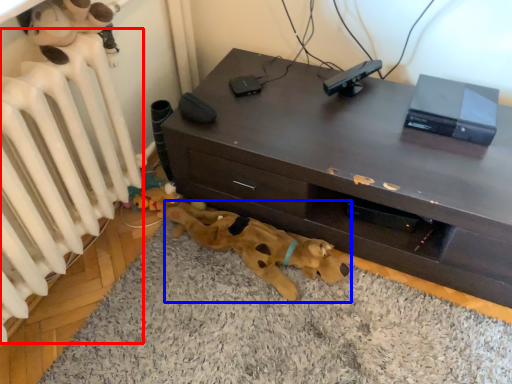
Question: Which point is closer to the camera, radiator (highlighted by a red box) or toy (highlighted by a blue box)?

Choices:
 (A) radiator
 (B) toy

Answer: (A)